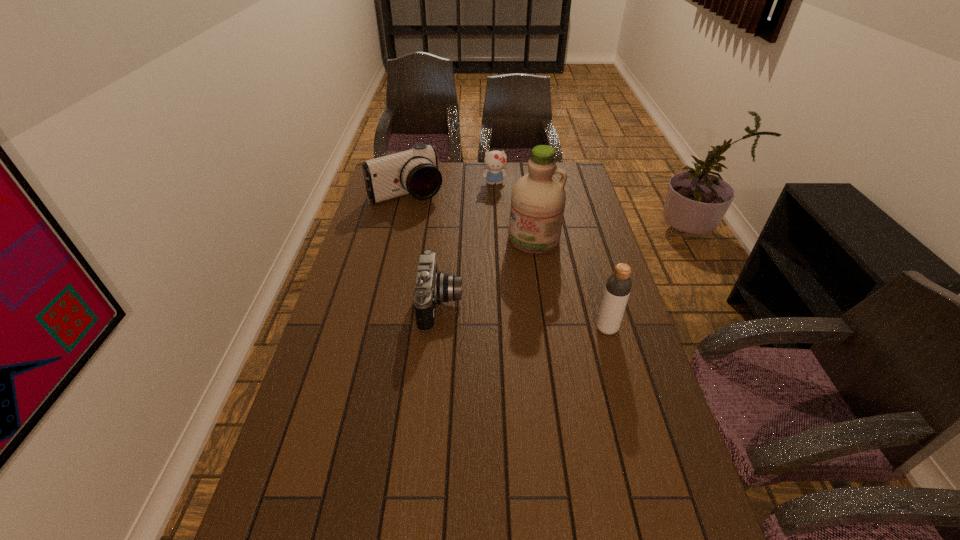
Locate an element on the screen. This screenshot has width=960, height=540. vacant area in the image that satisfies the following two spatial constraints: 1. on the front side of the camera; 2. on the front-facing side of the third tallest object is located at coordinates (381, 305).